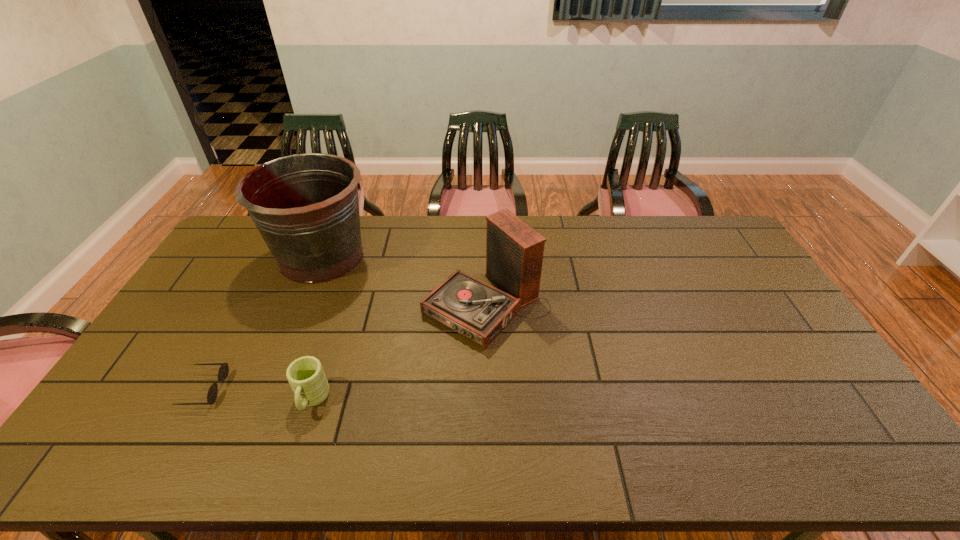
In order to click on free area in between the third tallest object and the rightmost object in this screenshot , I will do `click(399, 352)`.

What are the coordinates of `free spot between the mug and the tallest object` in the screenshot? It's located at (317, 328).

What are the coordinates of `vacant point located between the phonograph record and the sunglasses` in the screenshot? It's located at (346, 347).

Where is `vacant area that lies between the sunglasses and the phonograph record`? vacant area that lies between the sunglasses and the phonograph record is located at coordinates (346, 347).

Find the location of a particular element. This screenshot has height=540, width=960. object that can be found as the second closest to the shortest object is located at coordinates (306, 207).

Choose which object is the nearest neighbor to the bucket. Please provide its 2D coordinates. Your answer should be formatted as a tuple, i.e. [(x, y)], where the tuple contains the x and y coordinates of a point satisfying the conditions above.

[(514, 251)]